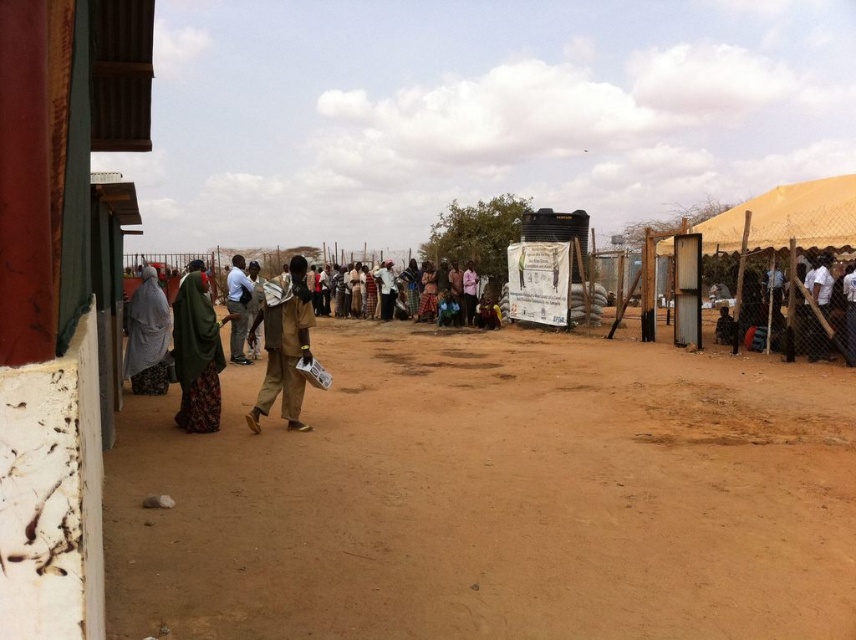
You are a photographer trying to capture both the green fabric headscarf at center and the brown fabric shirt at center in a single frame. Based on their heights, which object should you adjust your camera angle to focus on first to ensure both are in the shot?

The green fabric headscarf at center is not as tall as the brown fabric shirt at center, so you should focus on the brown fabric shirt at center first to ensure the shorter headscarf is also captured in the frame.